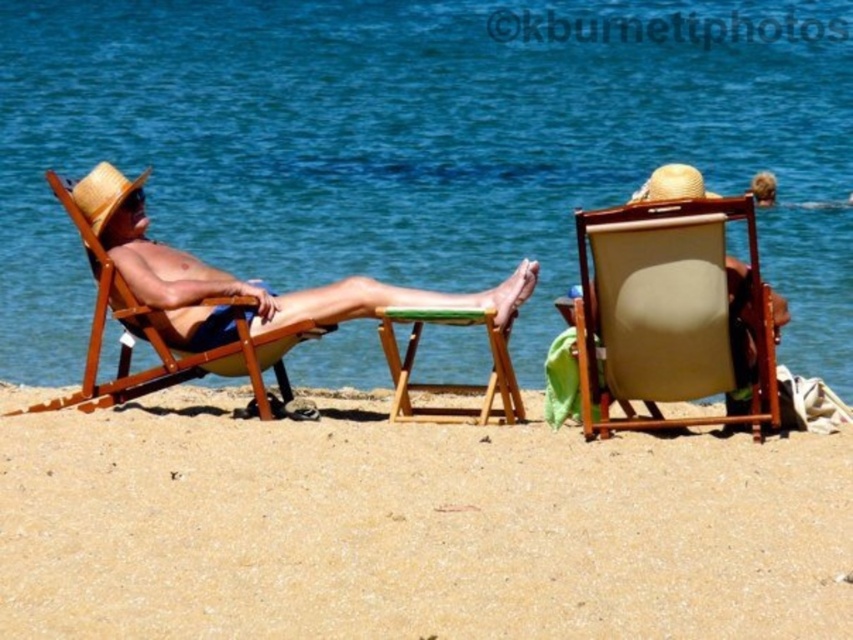
Which is behind, point (253, 378) or point (387, 323)?

Positioned behind is point (253, 378).

Which is more to the right, wooden beach chair at left or green wood stool at center?

green wood stool at center

Which is behind, point (244, 355) or point (505, 420)?

Point (505, 420)

I want to click on wooden beach chair at left, so click(167, 340).

What do you see at coordinates (666, 314) in the screenshot? I see `beige fabric beach chair at center` at bounding box center [666, 314].

Locate an element on the screen. beige fabric beach chair at center is located at coordinates pos(666,314).

This screenshot has width=853, height=640. Identify the location of beige fabric beach chair at center. (666, 314).

Between blue water at center and beige sandy beach at lower center, which one appears on the left side from the viewer's perspective?

From the viewer's perspective, blue water at center appears more on the left side.

This screenshot has height=640, width=853. Identify the location of blue water at center. (419, 145).

Between point (112, 328) and point (207, 593), which one is positioned in front?

Point (207, 593)

Locate an element on the screen. blue water at center is located at coordinates [x=419, y=145].